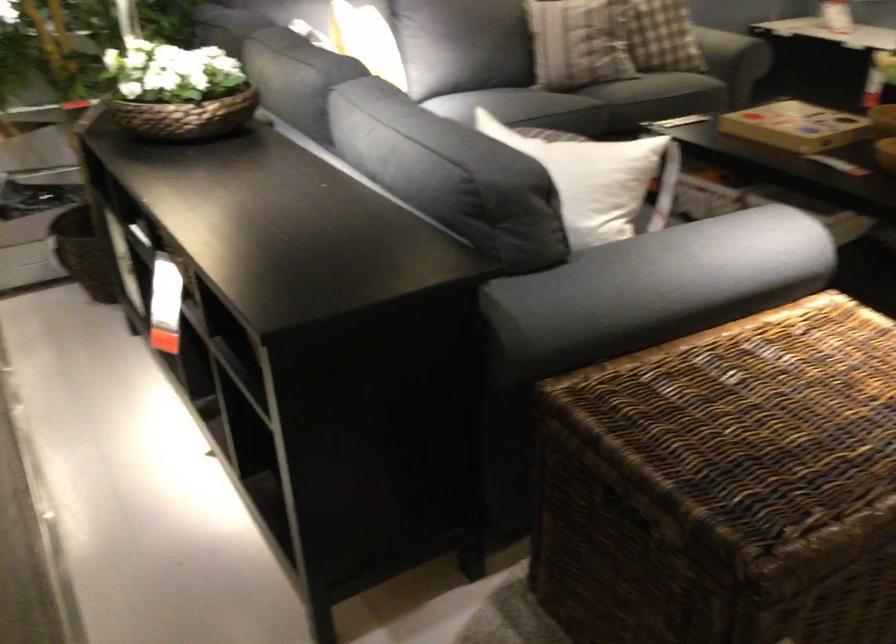
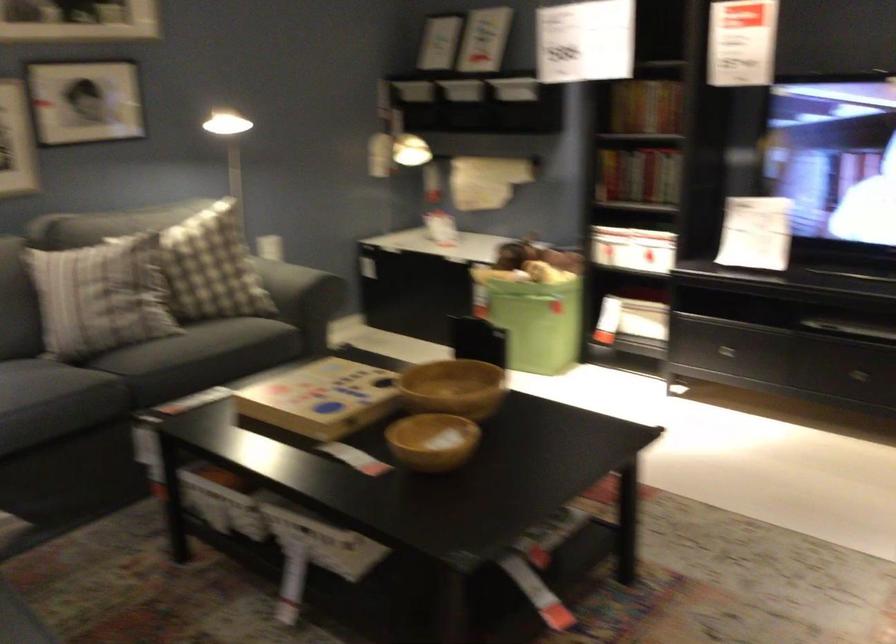
Locate, in the second image, the point that corresponds to the point at 814,114 in the first image.

(320, 399)